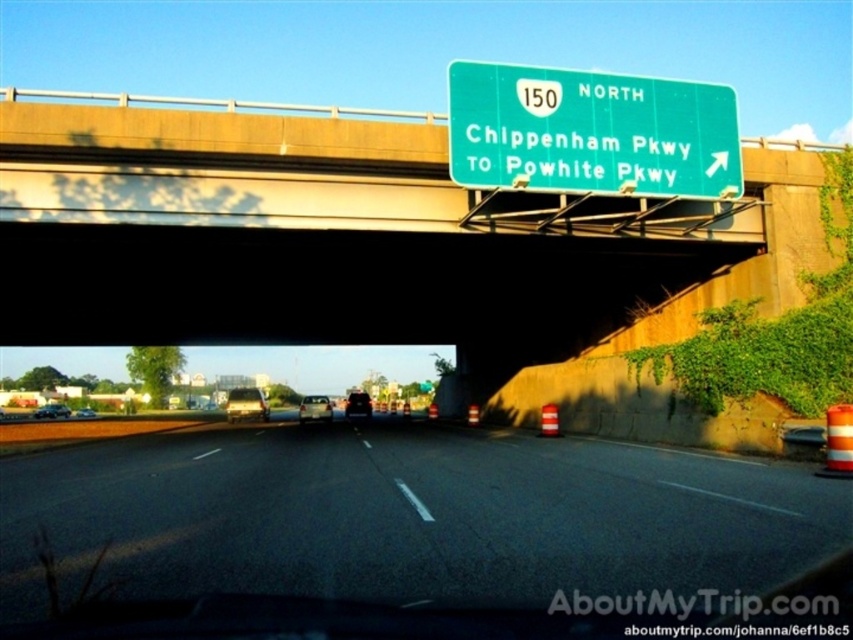
Question: Is the position of metallic silver sedan at center less distant than that of silver metallic sedan at center?

Choices:
 (A) no
 (B) yes

Answer: (B)

Question: Does satin silver sedan at center have a smaller size compared to shiny silver sedan at center?

Choices:
 (A) no
 (B) yes

Answer: (A)

Question: Which object is positioned closest to the metallic silver sedan at center?

Choices:
 (A) shiny silver sedan at center
 (B) black asphalt highway at center
 (C) black matte car at center

Answer: (C)

Question: Does black asphalt highway at center lie behind green metallic sign at upper center?

Choices:
 (A) yes
 (B) no

Answer: (B)

Question: Which object appears farthest from the camera in this image?

Choices:
 (A) silver metallic sedan at center
 (B) satin silver sedan at center
 (C) black matte car at center
 (D) black asphalt highway at center

Answer: (A)

Question: Which point is farther to the camera?

Choices:
 (A) (245, 412)
 (B) (354, 396)
 (C) (68, 410)
 (D) (90, 408)

Answer: (D)